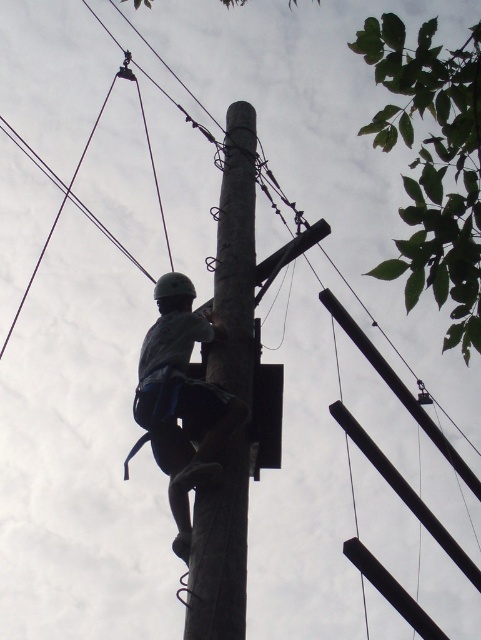
Question: Does dark gray fabric climbing harness at center lie in front of matte black helmet at center?

Choices:
 (A) no
 (B) yes

Answer: (B)

Question: Which object is farther from the camera taking this photo?

Choices:
 (A) dark gray fabric climbing harness at center
 (B) smooth wooden pole at center
 (C) matte black helmet at center

Answer: (C)

Question: Which object appears farthest from the camera in this image?

Choices:
 (A) smooth wooden pole at center
 (B) matte black helmet at center
 (C) dark gray fabric climbing harness at center

Answer: (B)

Question: Estimate the real-world distances between objects in this image. Which object is farther from the dark gray fabric climbing harness at center?

Choices:
 (A) smooth wooden pole at center
 (B) matte black helmet at center

Answer: (A)

Question: Is the position of smooth wooden pole at center less distant than that of dark gray fabric climbing harness at center?

Choices:
 (A) yes
 (B) no

Answer: (A)

Question: Can you confirm if smooth wooden pole at center is bigger than matte black helmet at center?

Choices:
 (A) yes
 (B) no

Answer: (A)